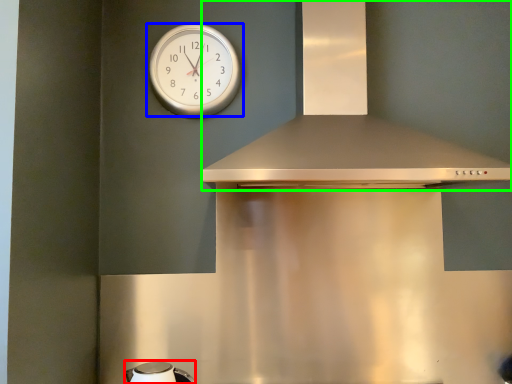
Question: Estimate the real-world distances between objects in this image. Which object is farther from appliance (highlighted by a red box), wall clock (highlighted by a blue box) or vent (highlighted by a green box)?

Choices:
 (A) wall clock
 (B) vent

Answer: (A)